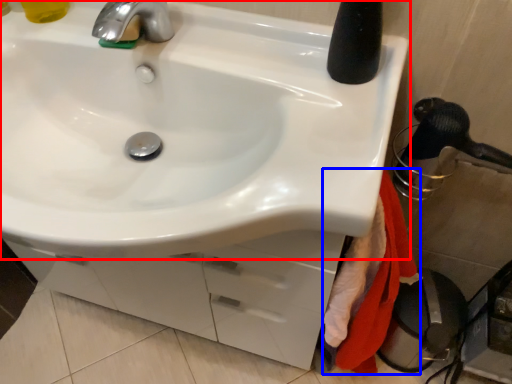
Question: Which object appears farthest to the camera in this image, sink (highlighted by a red box) or bath towel (highlighted by a blue box)?

Choices:
 (A) sink
 (B) bath towel

Answer: (B)